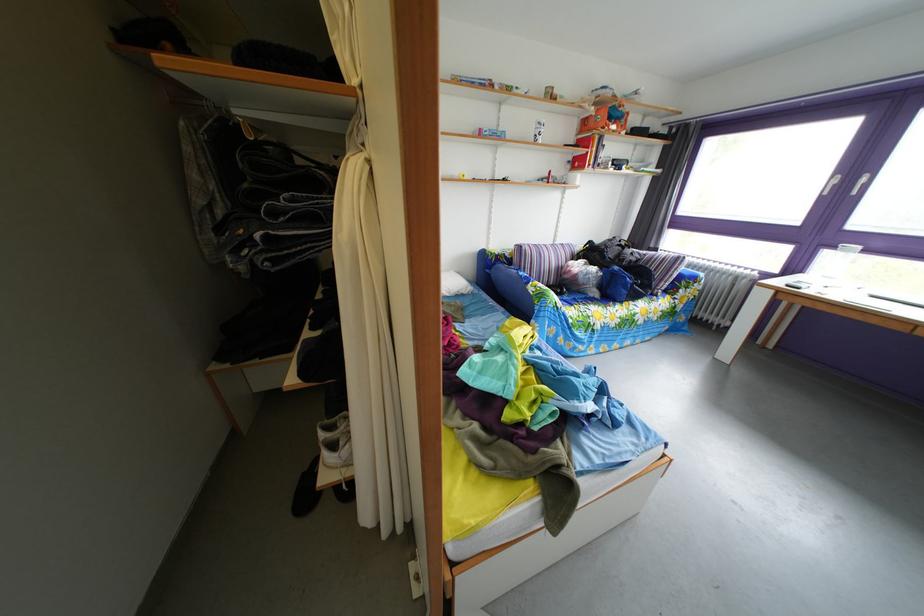
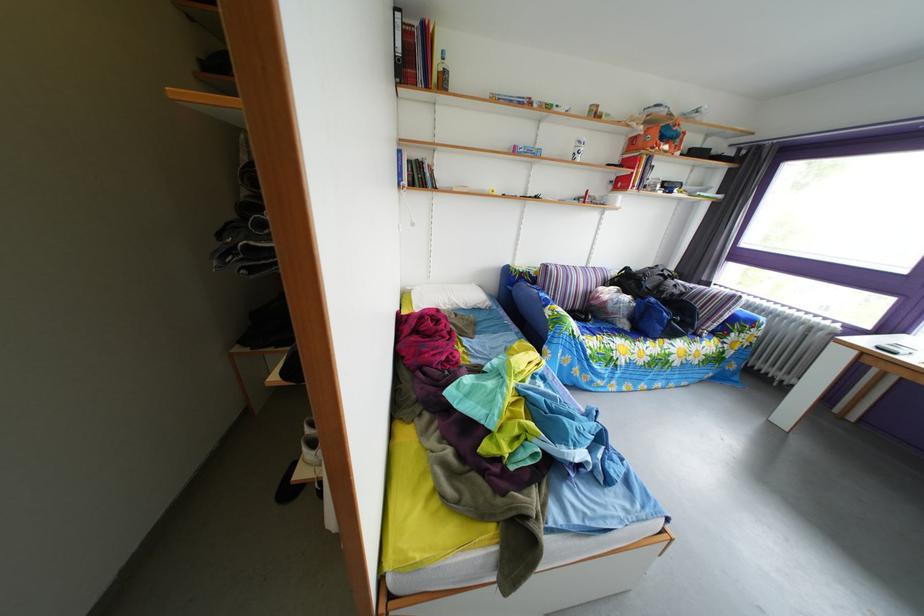
The point at (621,128) is marked in the first image. Where is the corresponding point in the second image?

(673, 147)